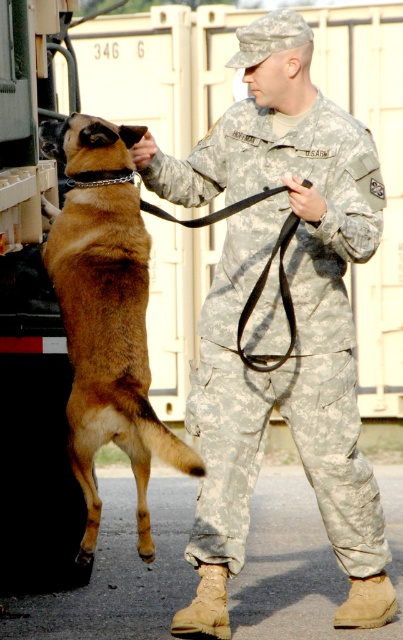
Question: Can you confirm if camouflage fabric uniform at center is positioned above brown fur dog at center?

Choices:
 (A) no
 (B) yes

Answer: (A)

Question: Does camouflage fabric uniform at center have a smaller size compared to brown fur dog at center?

Choices:
 (A) no
 (B) yes

Answer: (A)

Question: Which point appears farthest from the camera in this image?

Choices:
 (A) (342, 557)
 (B) (97, 323)

Answer: (A)

Question: Which point is farther to the camera?

Choices:
 (A) camouflage fabric uniform at center
 (B) brown fur dog at center

Answer: (A)

Question: Does camouflage fabric uniform at center have a lesser width compared to brown fur dog at center?

Choices:
 (A) no
 (B) yes

Answer: (A)